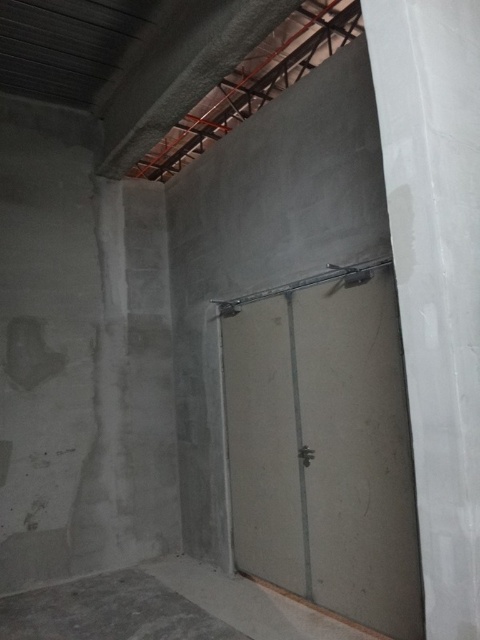
Question: Is white glossy pillar at right below gray concrete floor at lower left?

Choices:
 (A) yes
 (B) no

Answer: (B)

Question: Which of the following is the farthest from the observer?

Choices:
 (A) gray concrete floor at lower left
 (B) white glossy pillar at right

Answer: (A)

Question: Is white glossy pillar at right smaller than gray concrete floor at lower left?

Choices:
 (A) no
 (B) yes

Answer: (A)

Question: Which point is closer to the camera?

Choices:
 (A) (175, 602)
 (B) (476, 97)

Answer: (B)

Question: Can you confirm if white glossy pillar at right is positioned above gray concrete floor at lower left?

Choices:
 (A) yes
 (B) no

Answer: (A)